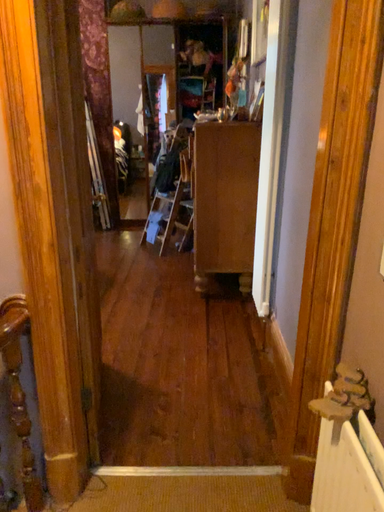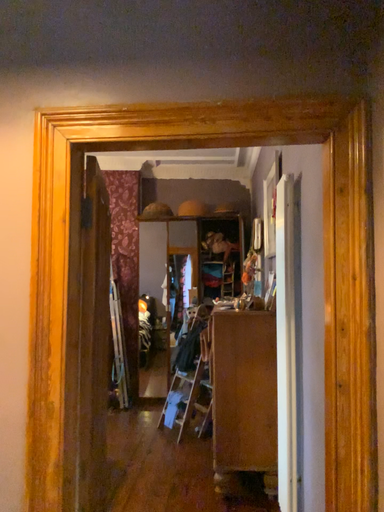
Question: How did the camera likely rotate when shooting the video?

Choices:
 (A) rotated upward
 (B) rotated downward

Answer: (A)